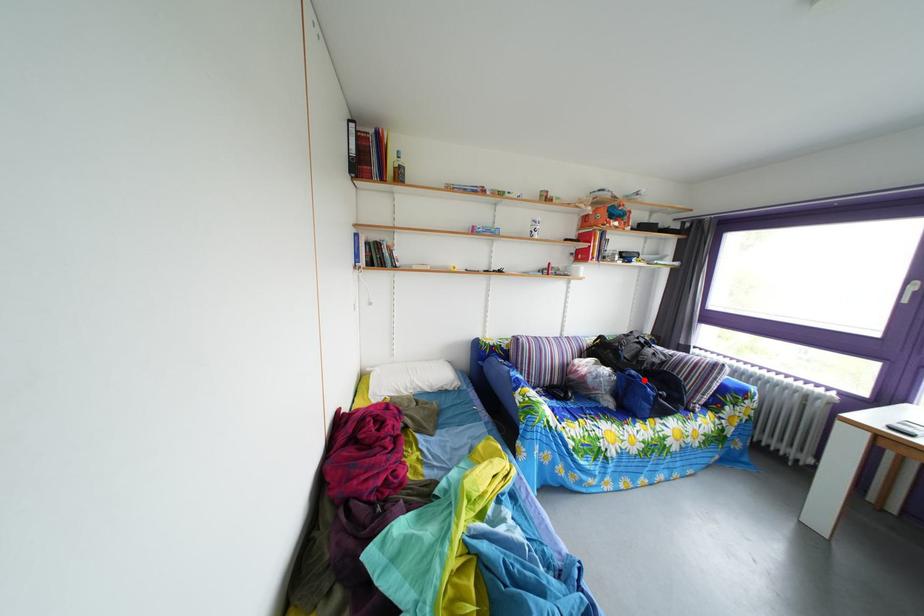
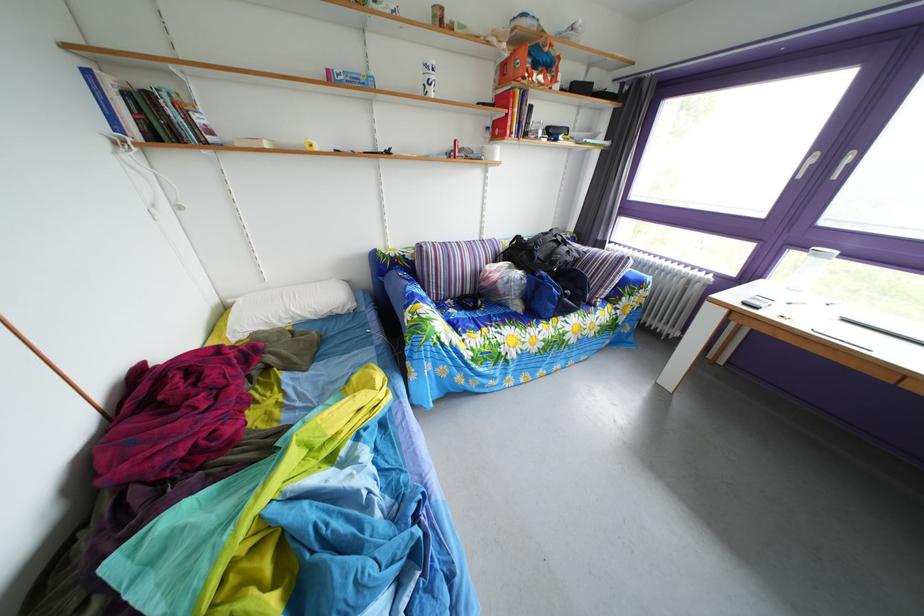
In the second image, find the point that corresponds to the highlighted location in the first image.

(553, 282)